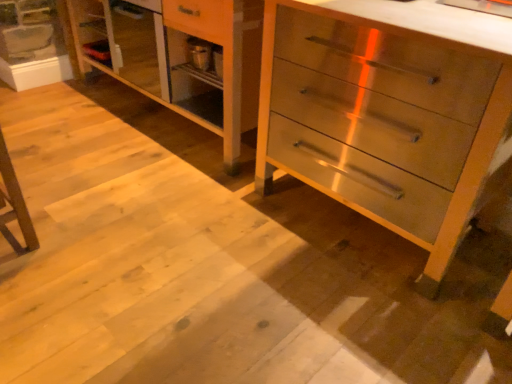
I want to click on space that is in front of light wood dresser at center, so click(155, 214).